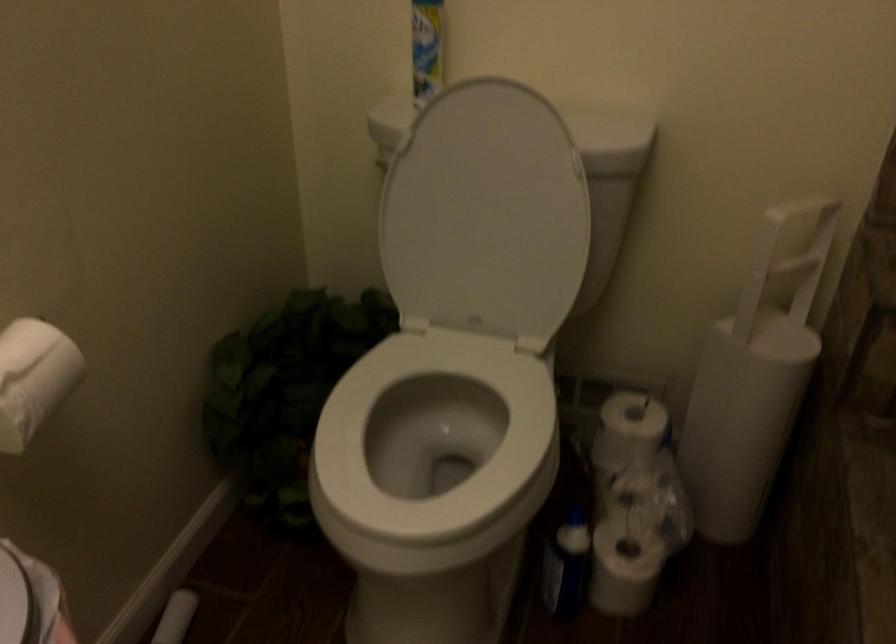
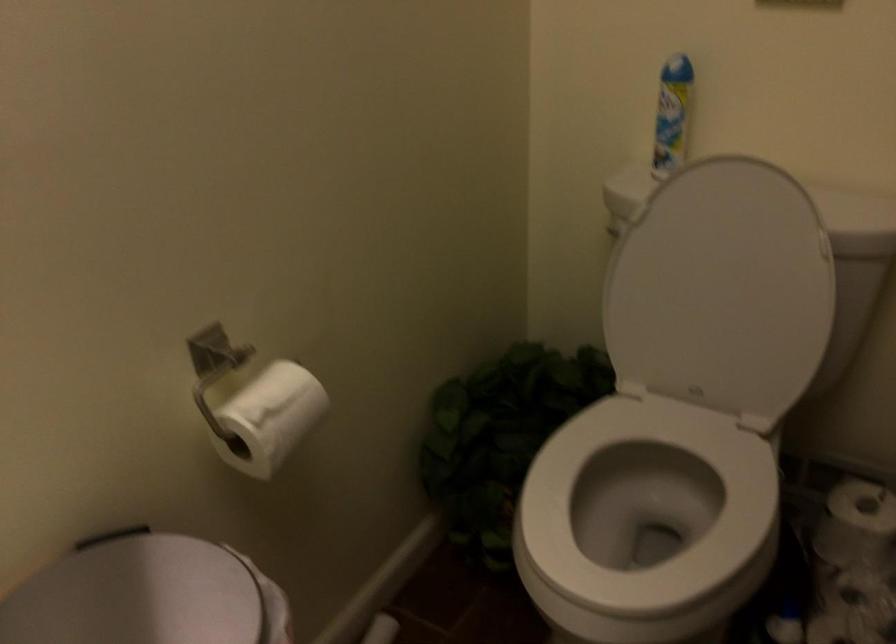
Locate, in the second image, the point that corresponds to point (627, 428) in the first image.

(856, 523)